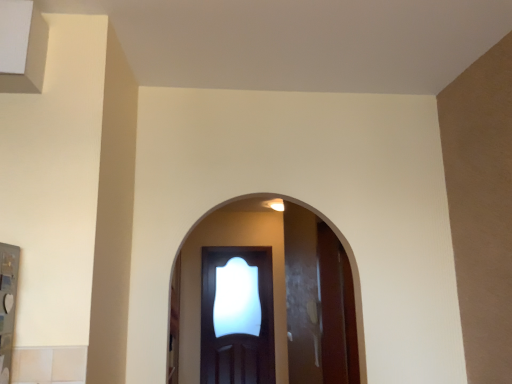
I want to click on clear glass screen door at center, so click(x=174, y=324).

What do you see at coordinates (174, 324) in the screenshot? I see `clear glass screen door at center` at bounding box center [174, 324].

Describe the element at coordinates (237, 316) in the screenshot. I see `glossy wood door at center` at that location.

Locate an element on the screen. glossy wood door at center is located at coordinates (237, 316).

From the picture: What is the approximate width of glossy wood door at center?

The width of glossy wood door at center is 19.54 centimeters.

I want to click on clear glass screen door at center, so click(x=174, y=324).

Which object is positioned more to the right, clear glass screen door at center or glossy wood door at center?

glossy wood door at center is more to the right.

Between clear glass screen door at center and glossy wood door at center, which one is positioned behind?

glossy wood door at center is more distant.

Between point (177, 383) and point (226, 255), which one is positioned behind?

The point (226, 255) is farther from the camera.

From the image's perspective, between clear glass screen door at center and glossy wood door at center, who is located below?

clear glass screen door at center appears lower in the image.

From a real-world perspective, is clear glass screen door at center positioned above or below glossy wood door at center?

clear glass screen door at center is situated lower than glossy wood door at center in the real world.

Which of these two, clear glass screen door at center or glossy wood door at center, is thinner?

clear glass screen door at center is thinner.

Can you confirm if clear glass screen door at center is shorter than glossy wood door at center?

Indeed, clear glass screen door at center has a lesser height compared to glossy wood door at center.

Between clear glass screen door at center and glossy wood door at center, which one has larger size?

Bigger between the two is glossy wood door at center.

Is clear glass screen door at center located outside glossy wood door at center?

That's correct, clear glass screen door at center is outside of glossy wood door at center.

Would you consider clear glass screen door at center to be distant from glossy wood door at center?

Yes, clear glass screen door at center and glossy wood door at center are quite far apart.

Is clear glass screen door at center aimed at glossy wood door at center?

Yes, clear glass screen door at center is facing glossy wood door at center.

Can you tell me how much clear glass screen door at center and glossy wood door at center differ in facing direction?

clear glass screen door at center and glossy wood door at center are facing 90.4 degrees away from each other.

I want to click on screen door below the glossy wood door at center (from a real-world perspective), so click(174, 324).

Which object is positioned more to the right, glossy wood door at center or clear glass screen door at center?

glossy wood door at center is more to the right.

Considering their positions, is glossy wood door at center located in front of or behind clear glass screen door at center?

glossy wood door at center is positioned farther from the viewer than clear glass screen door at center.

Does point (249, 280) come in front of point (177, 271)?

No, it is behind (177, 271).

From the image's perspective, which is above, glossy wood door at center or clear glass screen door at center?

glossy wood door at center is shown above in the image.

From a real-world perspective, is glossy wood door at center above or below clear glass screen door at center?

In terms of real-world spatial position, glossy wood door at center is above clear glass screen door at center.

Considering the sizes of objects glossy wood door at center and clear glass screen door at center in the image provided, who is thinner, glossy wood door at center or clear glass screen door at center?

With smaller width is clear glass screen door at center.

Which of these two, glossy wood door at center or clear glass screen door at center, stands taller?

glossy wood door at center is taller.

Between glossy wood door at center and clear glass screen door at center, which one has smaller size?

Smaller between the two is clear glass screen door at center.

Based on the photo, is glossy wood door at center situated inside clear glass screen door at center or outside?

glossy wood door at center is spatially situated outside clear glass screen door at center.

Are glossy wood door at center and clear glass screen door at center far apart?

glossy wood door at center is far away from clear glass screen door at center.

Is glossy wood door at center oriented away from clear glass screen door at center?

That's not correct — glossy wood door at center is not looking away from clear glass screen door at center.

Where is `screen door located in front of the glossy wood door at center`? The image size is (512, 384). screen door located in front of the glossy wood door at center is located at coordinates (174, 324).

Find the location of a particular element. The image size is (512, 384). door on the right of clear glass screen door at center is located at coordinates (237, 316).

I want to click on door above the clear glass screen door at center (from the image's perspective), so click(237, 316).